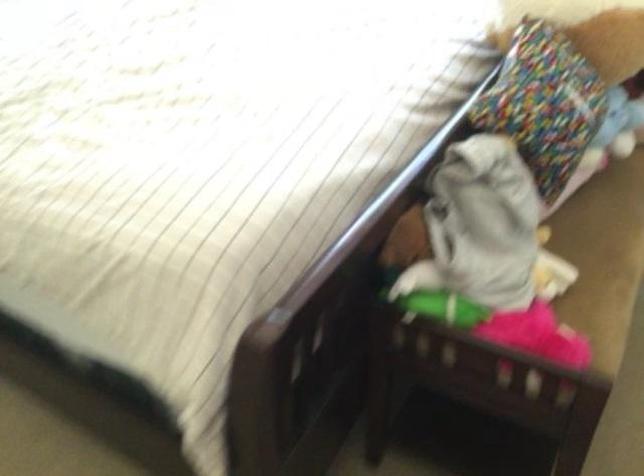
What do you see at coordinates (468, 76) in the screenshot? I see `the bed frame rail` at bounding box center [468, 76].